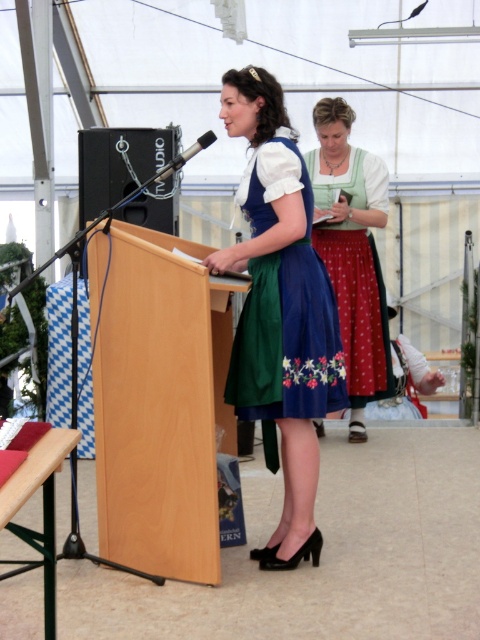
Question: Which of these objects is positioned closest to the black matte microphone at upper center?

Choices:
 (A) green satin dirndl at center
 (B) black matte speaker at center

Answer: (B)

Question: Which object is the farthest from the blue satin dirndl at center?

Choices:
 (A) green satin dirndl at center
 (B) black matte microphone at upper center
 (C) beech wood podium at center
 (D) matte blue dress at center

Answer: (A)

Question: Is beech wood podium at center behind green satin dirndl at center?

Choices:
 (A) yes
 (B) no

Answer: (B)

Question: Does blue satin dirndl at center have a smaller size compared to black matte microphone at upper center?

Choices:
 (A) no
 (B) yes

Answer: (A)

Question: Does blue satin dirndl at center have a lesser width compared to green satin dirndl at center?

Choices:
 (A) yes
 (B) no

Answer: (A)

Question: Which point is closer to the camera taking this photo?

Choices:
 (A) (100, 136)
 (B) (128, 289)

Answer: (B)